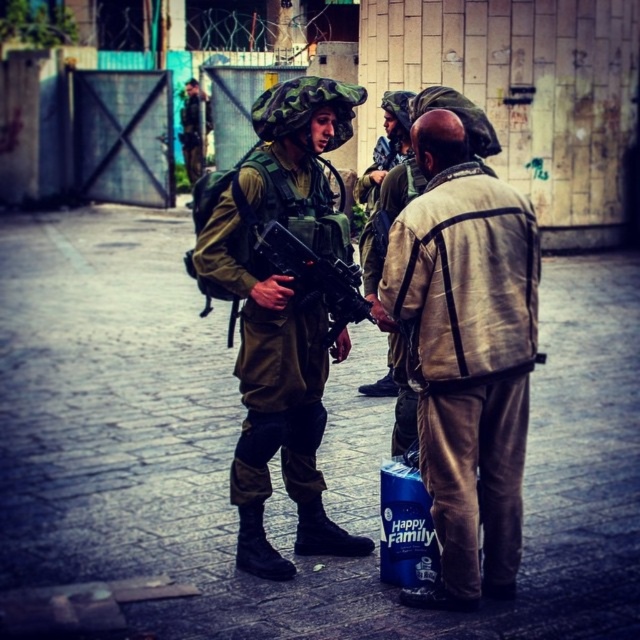
Question: Can you confirm if camouflage fabric uniform at center is positioned below matte black rifle at center?

Choices:
 (A) no
 (B) yes

Answer: (B)

Question: Observing the image, what is the correct spatial positioning of camouflage fabric uniform at center in reference to matte black rifle at center?

Choices:
 (A) right
 (B) left

Answer: (B)

Question: Which object appears farthest from the camera in this image?

Choices:
 (A) camouflage fabric uniform at center
 (B) tan fabric jacket at center
 (C) matte black rifle at center
 (D) camouflage uniform at upper left

Answer: (D)

Question: Which point is closer to the camera?

Choices:
 (A) (200, 173)
 (B) (506, 468)
 (C) (262, 531)

Answer: (B)

Question: Estimate the real-world distances between objects in this image. Which object is closer to the tan fabric jacket at center?

Choices:
 (A) camouflage fabric uniform at center
 (B) camouflage uniform at upper left

Answer: (A)

Question: Can you confirm if tan fabric jacket at center is bigger than camouflage fabric uniform at center?

Choices:
 (A) yes
 (B) no

Answer: (B)